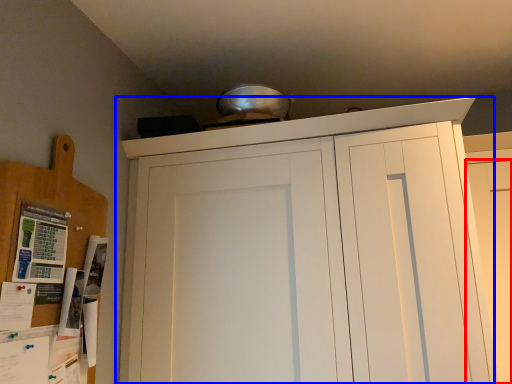
Question: Which of the following is the closest to the observer, door (highlighted by a red box) or cupboard (highlighted by a blue box)?

Choices:
 (A) door
 (B) cupboard

Answer: (B)